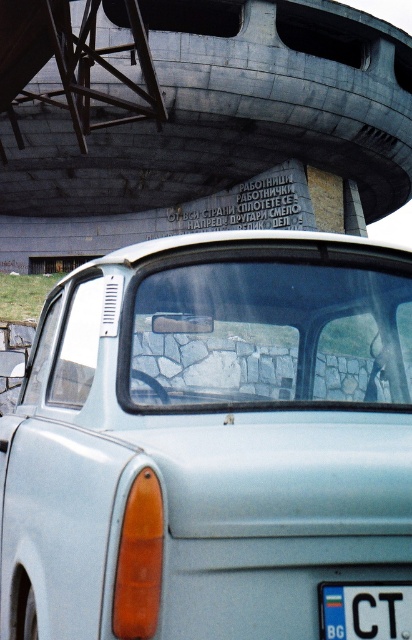
Who is more forward, (x=196, y=179) or (x=362, y=609)?

Positioned in front is point (x=362, y=609).

Can you confirm if gray concrete overpass at upper center is thinner than white plastic license plate at center?

No.

Is point (114, 170) more distant than point (360, 636)?

Yes, it is.

This screenshot has width=412, height=640. Identify the location of gray concrete overpass at upper center. (199, 104).

Is satin silver car at center taller than gray concrete overpass at upper center?

No, satin silver car at center is not taller than gray concrete overpass at upper center.

Which of these two, satin silver car at center or gray concrete overpass at upper center, stands taller?

Standing taller between the two is gray concrete overpass at upper center.

Measure the distance between satin silver car at center and camera.

satin silver car at center and camera are 1.67 meters apart from each other.

Where is `satin silver car at center`? The height and width of the screenshot is (640, 412). satin silver car at center is located at coordinates (208, 438).

Is satin silver car at center wider than white plastic license plate at center?

Correct, the width of satin silver car at center exceeds that of white plastic license plate at center.

Identify the location of satin silver car at center. (208, 438).

The width and height of the screenshot is (412, 640). In order to click on satin silver car at center in this screenshot , I will do `click(208, 438)`.